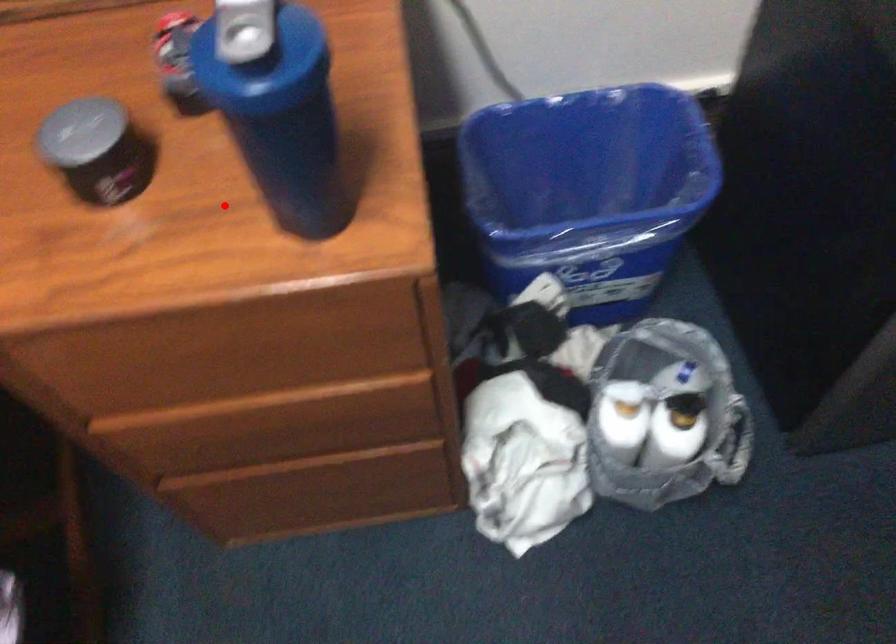
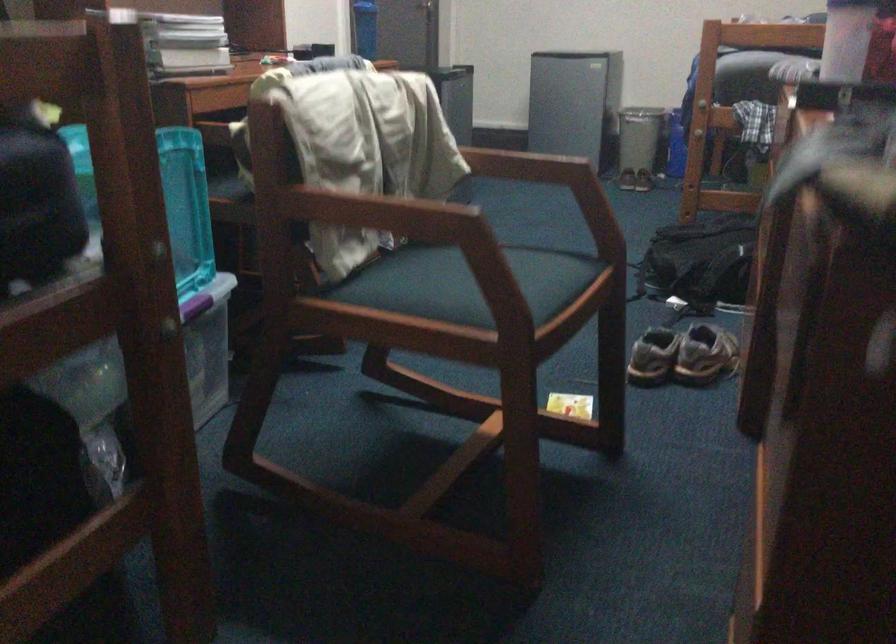
Question: A red point is marked in image1. In image2, is the corresponding 3D point closer to the camera or farther? Reply with the corresponding letter.

Choices:
 (A) The corresponding 3D point is closer.
 (B) The corresponding 3D point is farther.

Answer: (B)